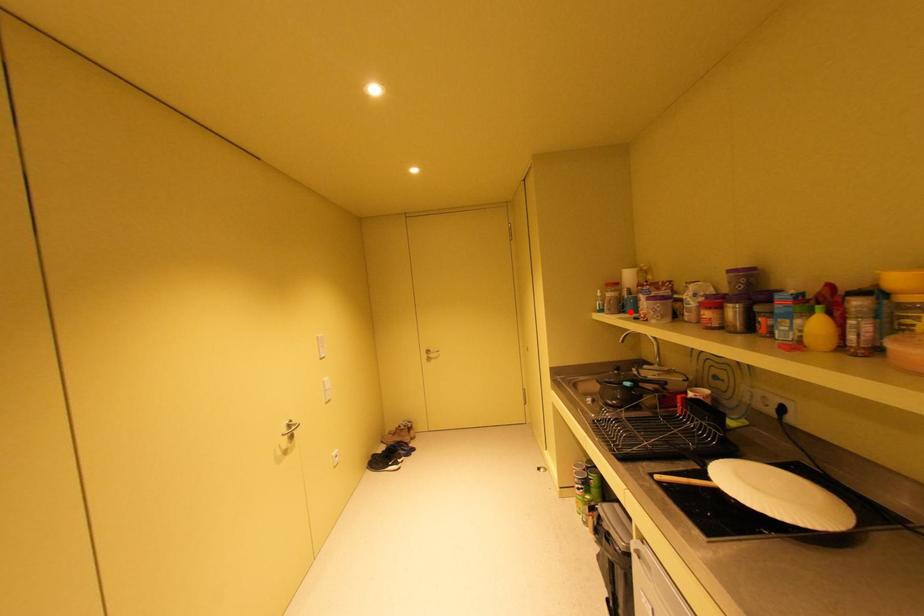
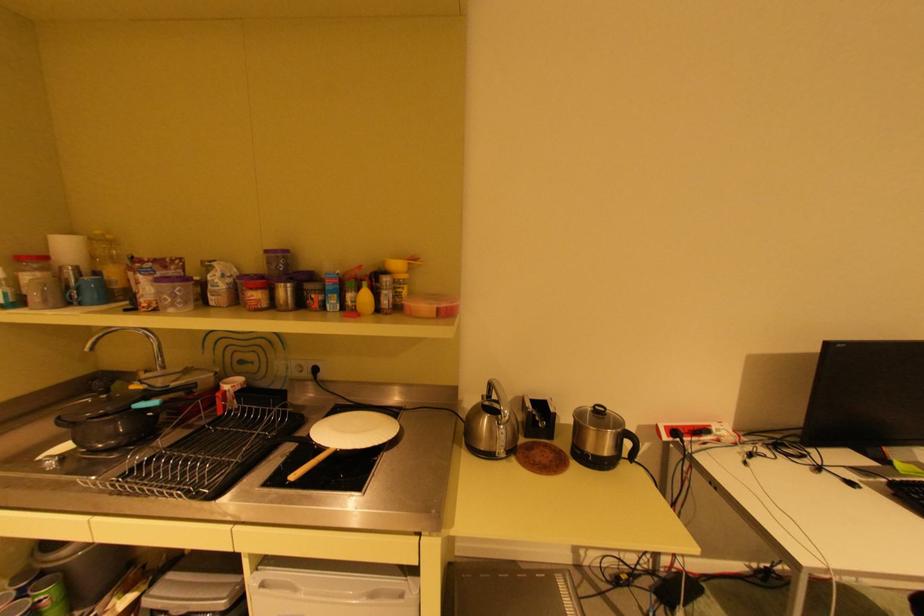
Locate, in the second image, the point that corresponds to the highlighted location in the first image.

(79, 302)